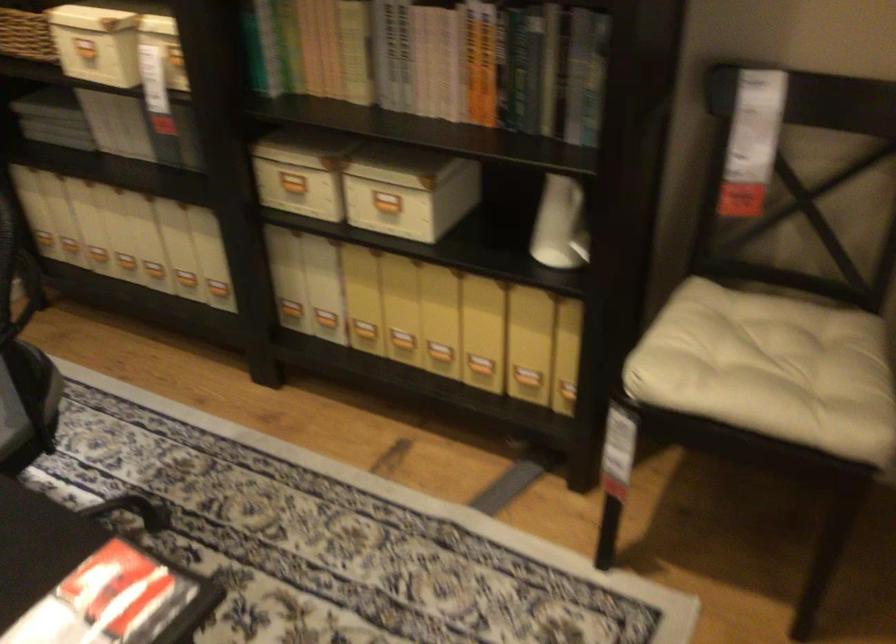
Describe the element at coordinates (582, 238) in the screenshot. I see `the white pitcher handle` at that location.